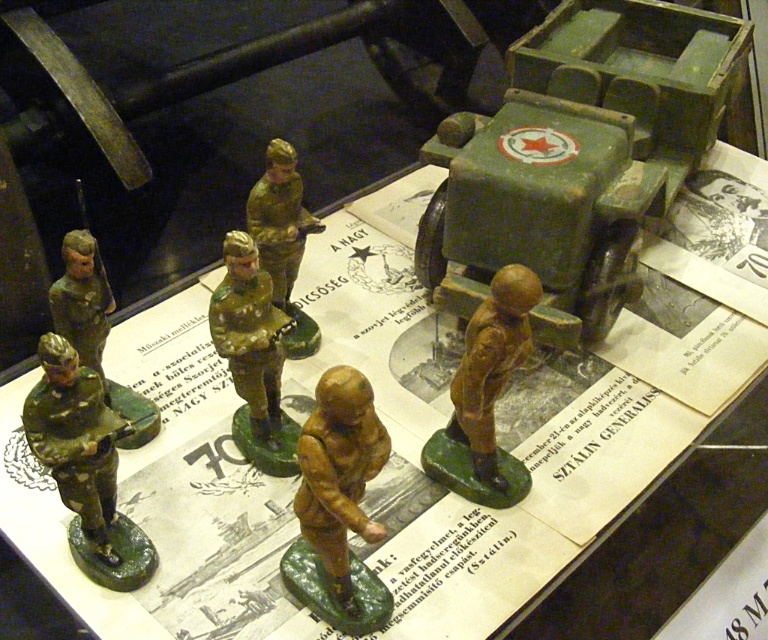
Question: Among these objects, which one is nearest to the camera?

Choices:
 (A) matte green truck at center
 (B) brown matte figurine at center
 (C) green matte toy soldier at lower left
 (D) matte green figure at center

Answer: (B)

Question: Does matte green truck at center lie in front of green matte toy soldier at lower left?

Choices:
 (A) yes
 (B) no

Answer: (B)

Question: Which point is closer to the camera?

Choices:
 (A) matte green figure at center
 (B) green matte toy soldier at lower left
 (C) matte green soldier at left
 (D) green matte toy soldier at center

Answer: (B)

Question: Estimate the real-world distances between objects in this image. Which object is farther from the brown matte figure at center?

Choices:
 (A) matte green figure at center
 (B) matte green truck at center
 (C) green matte toy soldier at lower left
 (D) matte green soldier at left

Answer: (D)

Question: Is matte green truck at center smaller than brown matte figure at center?

Choices:
 (A) yes
 (B) no

Answer: (B)

Question: Can you confirm if brown matte figurine at center is wider than matte green figure at center?

Choices:
 (A) no
 (B) yes

Answer: (B)